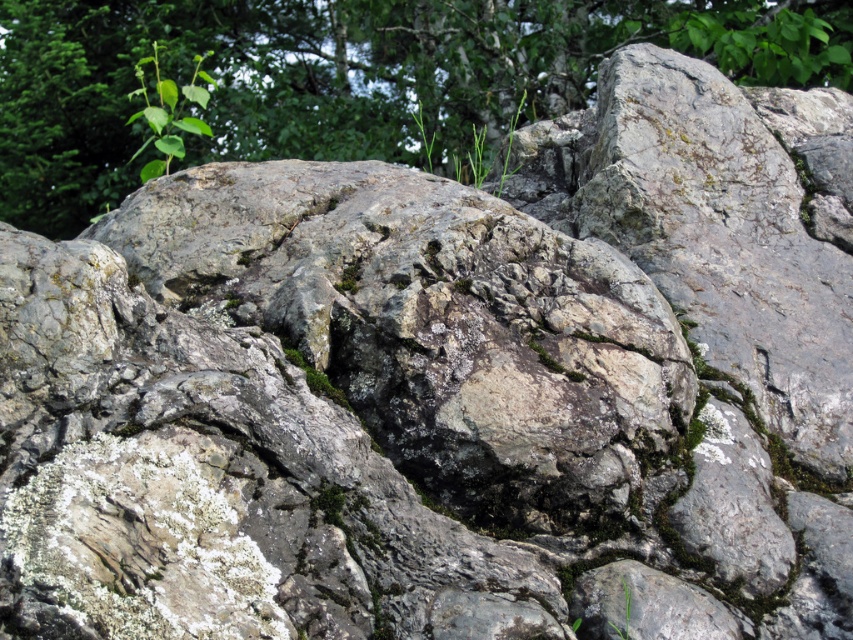
Is green leafy tree at upper center above green grass at upper center?

Correct, green leafy tree at upper center is located above green grass at upper center.

Is the position of green leafy tree at upper center less distant than that of green grass at upper center?

No, it is behind green grass at upper center.

You are a GUI agent. You are given a task and a screenshot of the screen. Output one action in this format:
    pyautogui.click(x=<x>, y=<y>)
    Task: Click on the green leafy tree at upper center
    This screenshot has height=640, width=853.
    Given the screenshot: What is the action you would take?
    pyautogui.click(x=346, y=76)

Identify the location of green leafy tree at upper center. (346, 76).

Identify the location of green leafy plant at upper left. (167, 113).

Is green leafy plant at upper left above green grass at upper center?

Yes, green leafy plant at upper left is above green grass at upper center.

Does point (207, 80) come closer to viewer compared to point (498, 193)?

No.

Find the location of a particular element. Image resolution: width=853 pixels, height=640 pixels. green leafy plant at upper left is located at coordinates pos(167,113).

Is green leafy tree at upper center further to camera compared to green leafy plant at upper left?

No, green leafy tree at upper center is closer to the viewer.

Does green leafy tree at upper center appear on the right side of green leafy plant at upper left?

Correct, you'll find green leafy tree at upper center to the right of green leafy plant at upper left.

I want to click on green leafy tree at upper center, so click(346, 76).